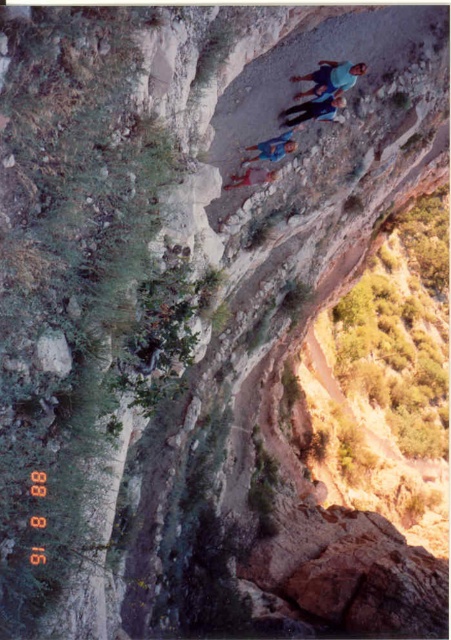
Between blue fabric shirt at upper center and blue denim jeans at center, which one appears on the right side from the viewer's perspective?

blue fabric shirt at upper center is more to the right.

Is blue fabric shirt at upper center thinner than blue denim jeans at center?

Yes, blue fabric shirt at upper center is thinner than blue denim jeans at center.

Where is `blue fabric shirt at upper center`? blue fabric shirt at upper center is located at coordinates (331, 77).

The width and height of the screenshot is (451, 640). In order to click on blue fabric shirt at upper center in this screenshot , I will do `click(331, 77)`.